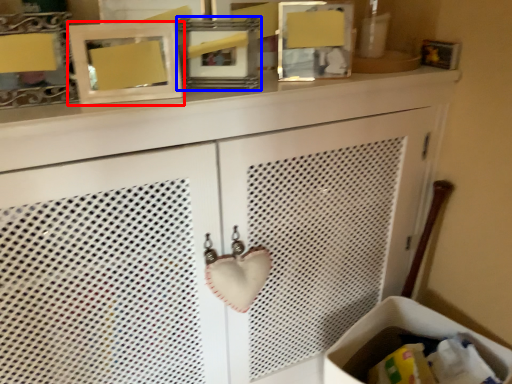
Question: Which point is further to the camera, picture frame (highlighted by a red box) or picture frame (highlighted by a blue box)?

Choices:
 (A) picture frame
 (B) picture frame

Answer: (B)